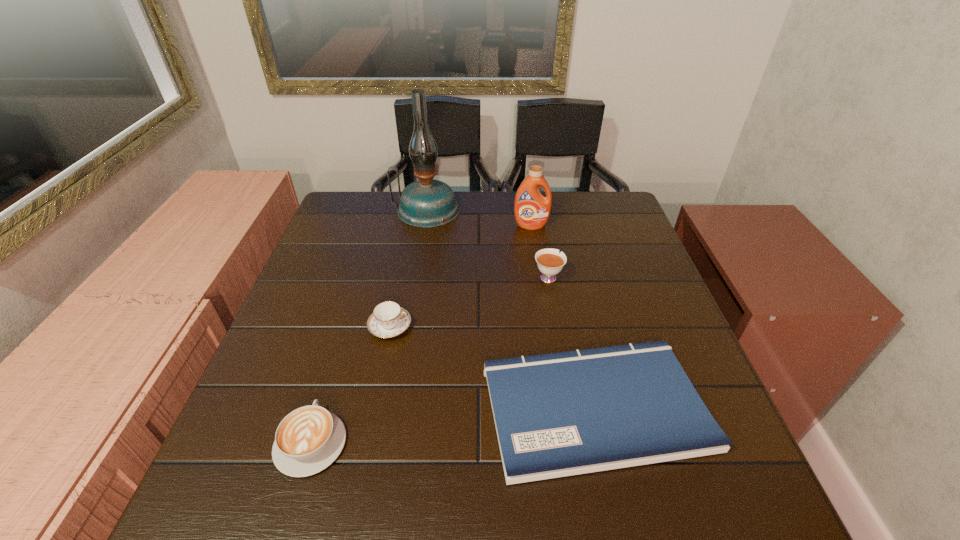
Locate an element on the screen. Image resolution: width=960 pixels, height=540 pixels. free spot located 0.090m on the side of the right teacup with the handle is located at coordinates (542, 246).

The height and width of the screenshot is (540, 960). I want to click on free space located 0.140m on the side of the right teacup with the handle, so click(x=540, y=235).

The width and height of the screenshot is (960, 540). I want to click on vacant space located 0.340m on the side of the right teacup with the handle, so [535, 200].

The height and width of the screenshot is (540, 960). Find the location of `vacant space located 0.120m on the side with the handle of the shorter teacup`. vacant space located 0.120m on the side with the handle of the shorter teacup is located at coordinates (464, 327).

At what (x,y) coordinates should I click in order to perform the action: click on blank area located 0.360m on the side of the cappuccino with the handle. Please return your answer as a coordinate pair (x, y). Looking at the image, I should click on (359, 286).

I want to click on free space located 0.310m on the side of the cappuccino with the handle, so click(x=355, y=300).

What are the coordinates of `free space located on the side of the cappuccino with the handle` in the screenshot? It's located at (361, 278).

You are a GUI agent. You are given a task and a screenshot of the screen. Output one action in this format:
    pyautogui.click(x=<x>, y=<y>)
    Task: Click on the vacant space located on the left of the paperback book
    This screenshot has width=960, height=540.
    Given the screenshot: What is the action you would take?
    pyautogui.click(x=330, y=408)

I want to click on oil lamp that is at the far edge, so click(x=426, y=203).

The image size is (960, 540). Identify the location of detergent that is positioned at the far edge. (531, 210).